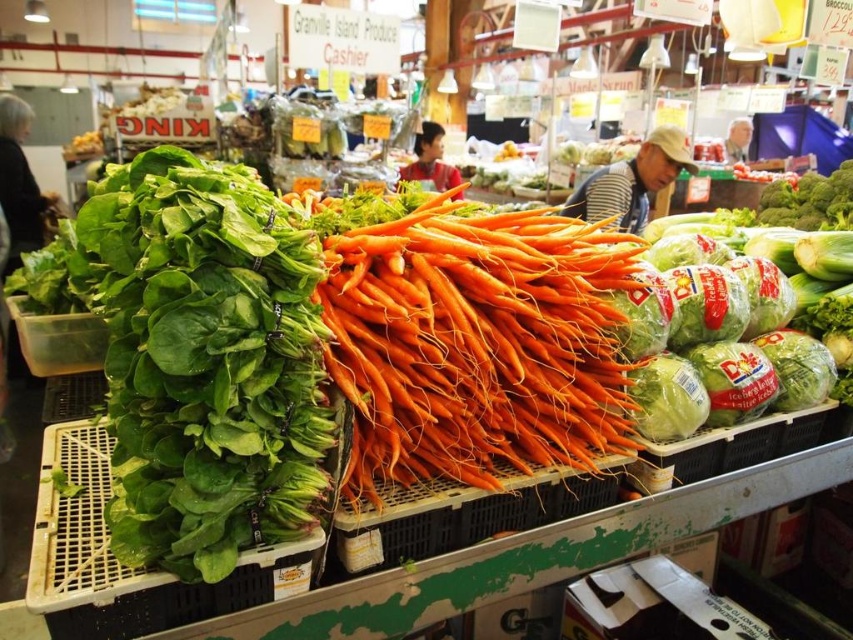
You are a customer at the market and want to grab both the orange smooth carrots at center and the green leafy at center. Which one should you reach for first if you want to pick the one closer to your right side?

The green leafy at center is to the right of orange smooth carrots at center, so you should reach for the green leafy at center first if you want the one closer to your right side.